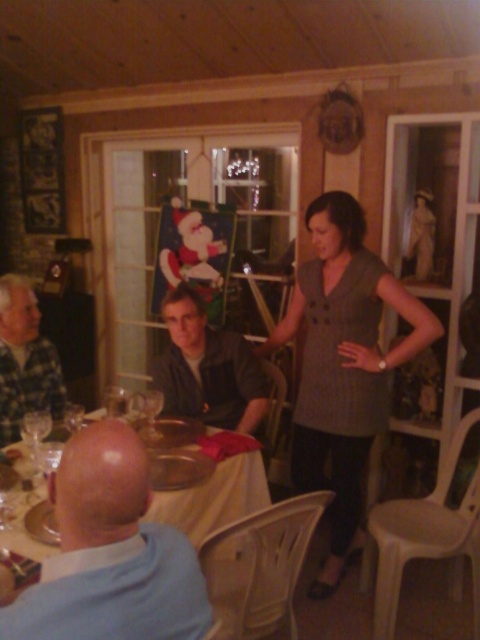
Question: Can you confirm if matte gray dress at center is thinner than transparent glass at table left?

Choices:
 (A) no
 (B) yes

Answer: (A)

Question: Which object appears farthest from the camera in this image?

Choices:
 (A) dark gray fabric shirt at center
 (B) plaid fabric shirt at left
 (C) gray textured dress at center
 (D) transparent glass at table left

Answer: (A)

Question: Which of the following is the closest to the observer?

Choices:
 (A) plaid fabric shirt at left
 (B) gray textured dress at center

Answer: (B)

Question: Which point appears farthest from the camera in this image?

Choices:
 (A) (190, 353)
 (B) (8, 397)
 (C) (148, 392)

Answer: (C)

Question: Can you confirm if gray textured dress at center is smaller than dark gray fabric shirt at center?

Choices:
 (A) yes
 (B) no

Answer: (B)

Question: Is matte gray dress at center closer to the viewer compared to transparent glass at table left?

Choices:
 (A) no
 (B) yes

Answer: (A)